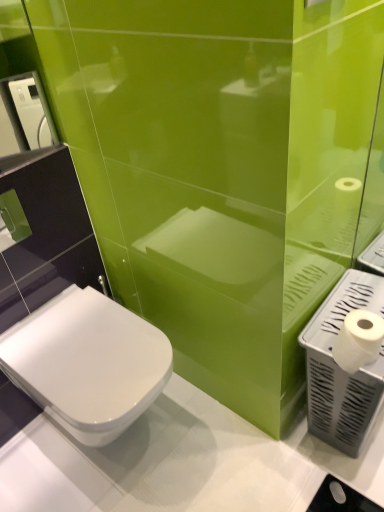
Question: From a real-world perspective, does white plastic hand dryer at upper left, positioned as the second hand dryer in bottom-to-top order, stand above white matte toilet paper at right?

Choices:
 (A) no
 (B) yes

Answer: (B)

Question: Is white plastic hand dryer at upper left, which is the first hand dryer from left to right, taller than white matte toilet paper at right?

Choices:
 (A) no
 (B) yes

Answer: (B)

Question: From the image's perspective, is white plastic hand dryer at upper left, which is the first hand dryer from left to right, located above white matte toilet paper at right?

Choices:
 (A) yes
 (B) no

Answer: (A)

Question: Is white plastic hand dryer at upper left, positioned as the second hand dryer in bottom-to-top order, wider than white matte toilet paper at right?

Choices:
 (A) no
 (B) yes

Answer: (A)

Question: Is white plastic hand dryer at upper left, which ranks as the first hand dryer in top-to-bottom order, positioned with its back to white matte toilet paper at right?

Choices:
 (A) yes
 (B) no

Answer: (B)

Question: Does point (357, 437) appear closer or farther from the camera than point (6, 98)?

Choices:
 (A) farther
 (B) closer

Answer: (B)

Question: Visually, is white plastic hand dryer at right, the first hand dryer in the bottom-to-top sequence, positioned to the left or to the right of white plastic hand dryer at upper left, which is the first hand dryer from left to right?

Choices:
 (A) right
 (B) left

Answer: (A)

Question: Considering the positions of white plastic hand dryer at right, the first hand dryer in the bottom-to-top sequence, and white plastic hand dryer at upper left, the second hand dryer from the right, in the image, is white plastic hand dryer at right, the first hand dryer in the bottom-to-top sequence, wider or thinner than white plastic hand dryer at upper left, the second hand dryer from the right,?

Choices:
 (A) wide
 (B) thin

Answer: (A)

Question: Is white plastic hand dryer at right, the second hand dryer in the left-to-right sequence, inside or outside of white plastic hand dryer at upper left, the second hand dryer from the right?

Choices:
 (A) inside
 (B) outside

Answer: (B)

Question: Relative to white matte toilet paper at right, is white plastic hand dryer at upper left, which is the first hand dryer from left to right, in front or behind?

Choices:
 (A) behind
 (B) front

Answer: (A)

Question: Is white plastic hand dryer at upper left, the second hand dryer from the right, to the left or to the right of white matte toilet paper at right in the image?

Choices:
 (A) left
 (B) right

Answer: (A)

Question: Is white plastic hand dryer at upper left, positioned as the second hand dryer in bottom-to-top order, bigger or smaller than white matte toilet paper at right?

Choices:
 (A) big
 (B) small

Answer: (A)

Question: Choose the correct answer: Is white plastic hand dryer at upper left, which ranks as the first hand dryer in top-to-bottom order, inside white matte toilet paper at right or outside it?

Choices:
 (A) inside
 (B) outside

Answer: (B)

Question: Is point (350, 312) positioned closer to the camera than point (352, 406)?

Choices:
 (A) farther
 (B) closer

Answer: (B)

Question: From the image's perspective, is white matte toilet paper at right above or below white plastic hand dryer at right, the second hand dryer in the left-to-right sequence?

Choices:
 (A) above
 (B) below

Answer: (A)